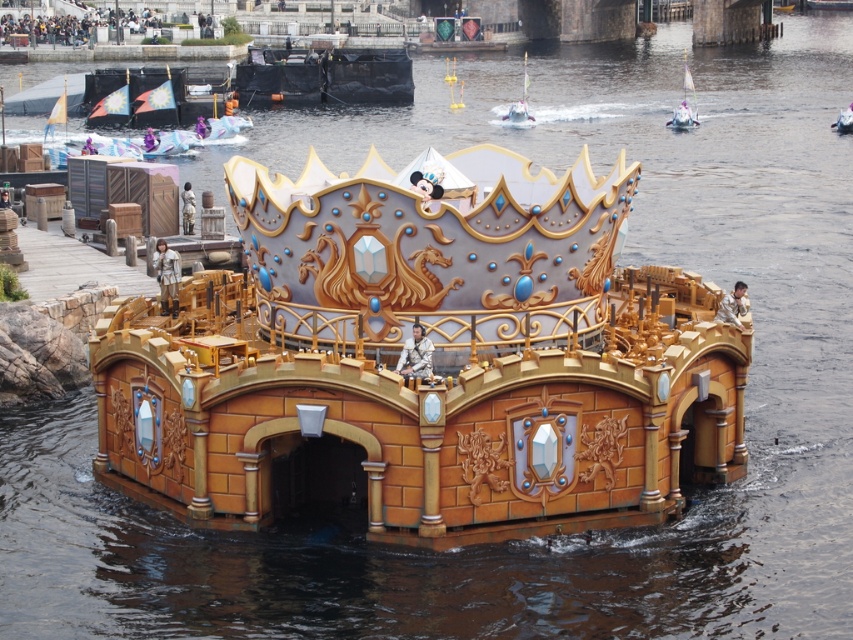
You are an architect designing a new floating structure. You need to place both the metallic silver sailboat at upper center and the metallic silver boat at center in a way that their widths are proportional to their sizes. Which boat should be placed closer to the central axis of the structure to maintain visual balance?

The metallic silver sailboat at upper center has a lesser width compared to the metallic silver boat at center. To maintain visual balance, the narrower metallic silver sailboat at upper center should be placed closer to the central axis, while the wider metallic silver boat at center can be positioned further out, as smaller objects are typically placed closer to the center for balance.

You are an observer looking at the floating structure. You see a metallic silver sailboat at upper center and a metallic silver boat at center. Which one is positioned to the left of the other?

The metallic silver sailboat at upper center is positioned to the left of the metallic silver boat at center.

You are standing on the deck of the metallic silver sailboat at upper center and want to see the metallic silver boat at center. Which direction should you look to see it?

The metallic silver boat at center is behind the metallic silver sailboat at upper center, so you should look behind the metallic silver sailboat at upper center to see it.